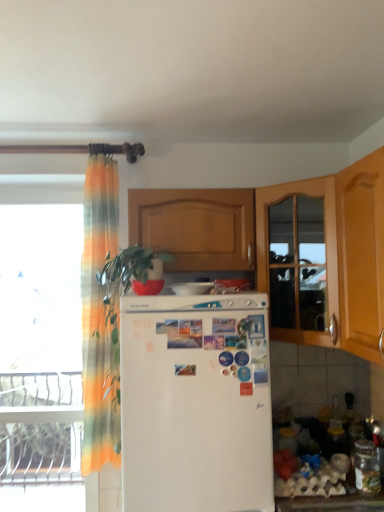
Identify the location of free location in front of white glossy refrigerator at center. This screenshot has width=384, height=512. (191, 293).